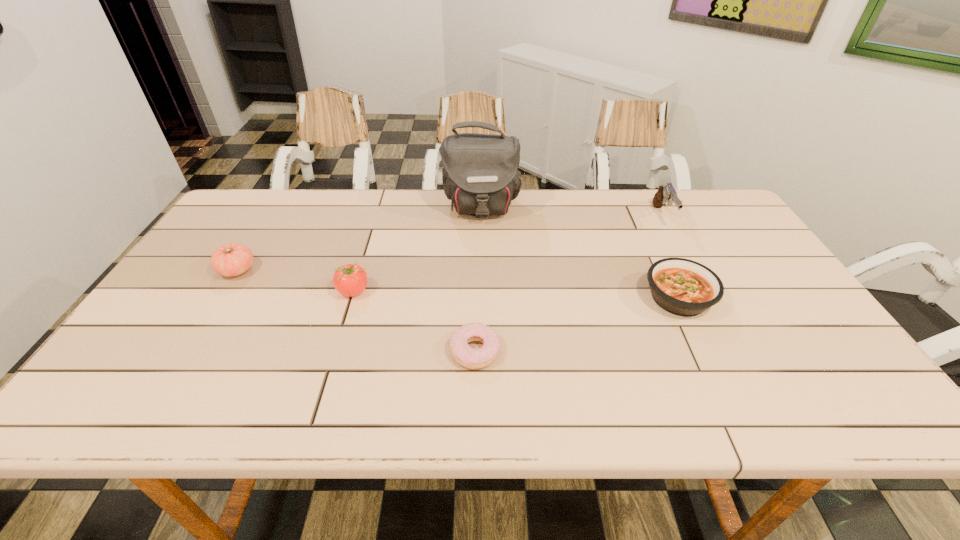
Identify the location of blank space located 0.270m on the right of the left tomato. This screenshot has height=540, width=960. (354, 270).

The height and width of the screenshot is (540, 960). Identify the location of vacant space located 0.050m on the back of the stew. [x=661, y=263].

Find the location of a particular element. free spot located 0.370m on the left of the shortest object is located at coordinates (288, 350).

At what (x,y) coordinates should I click in order to perform the action: click on shoulder bag located in the far edge section of the desktop. Please return your answer as a coordinate pair (x, y). The image size is (960, 540). Looking at the image, I should click on [x=480, y=176].

Identify the location of pistol situated at the far edge. Image resolution: width=960 pixels, height=540 pixels. (667, 193).

In order to click on object that is at the left edge in this screenshot , I will do `click(233, 259)`.

You are a GUI agent. You are given a task and a screenshot of the screen. Output one action in this format:
    pyautogui.click(x=<x>, y=<y>)
    Task: Click on the vacant region at the far edge of the desktop
    This screenshot has height=540, width=960.
    Given the screenshot: What is the action you would take?
    pyautogui.click(x=293, y=204)

What are the coordinates of `vacant space at the near edge` in the screenshot? It's located at (793, 399).

At what (x,y) coordinates should I click in order to perform the action: click on free space at the left edge of the desktop. Please return your answer as a coordinate pair (x, y). Looking at the image, I should click on (222, 237).

Where is `vacant space at the right edge`? This screenshot has width=960, height=540. vacant space at the right edge is located at coordinates (805, 328).